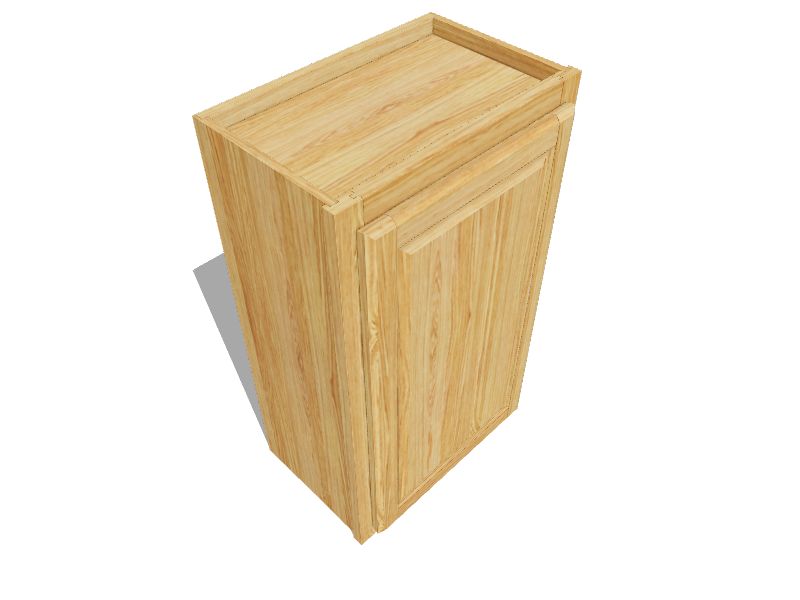
Where is `left side of the wood box`? This screenshot has height=600, width=800. left side of the wood box is located at coordinates (298, 312).